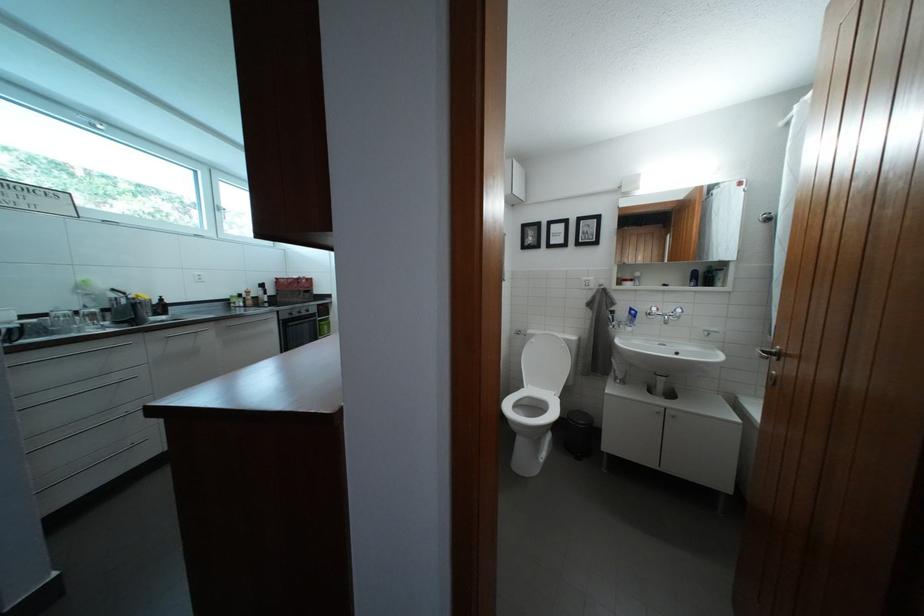
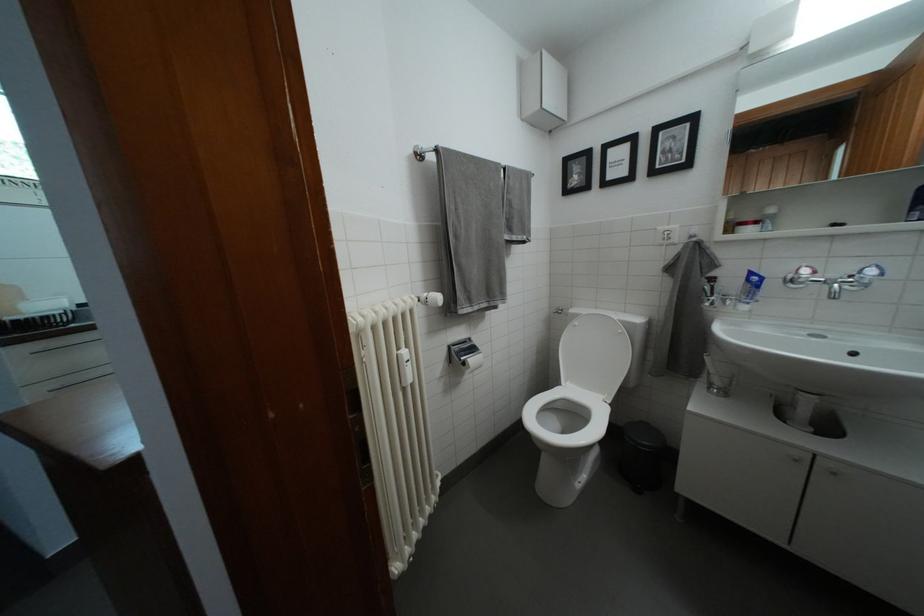
What movement of the cameraman would produce the second image?

The cameraman walked toward right, forward.